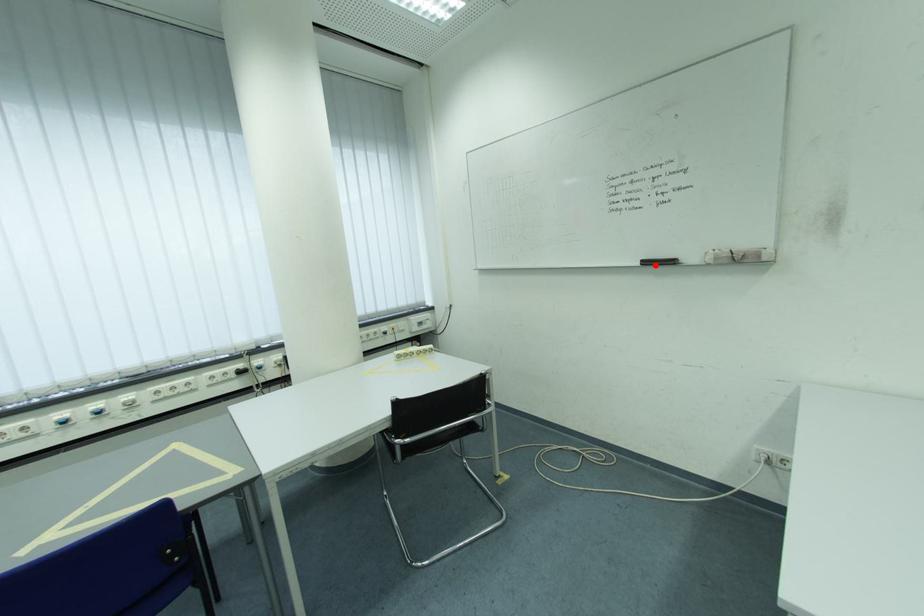
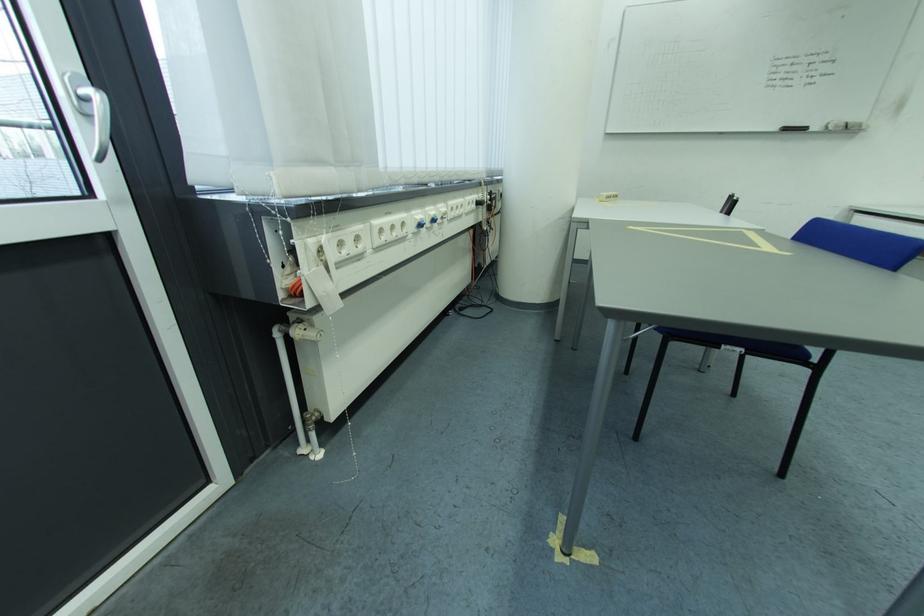
Question: I am providing you with two images of the same scene from different viewpoints. Image1 has a red point marked. In image2, the corresponding 3D location appears at what relative position? Reply with the corresponding letter.

Choices:
 (A) Closer
 (B) Farther

Answer: (B)